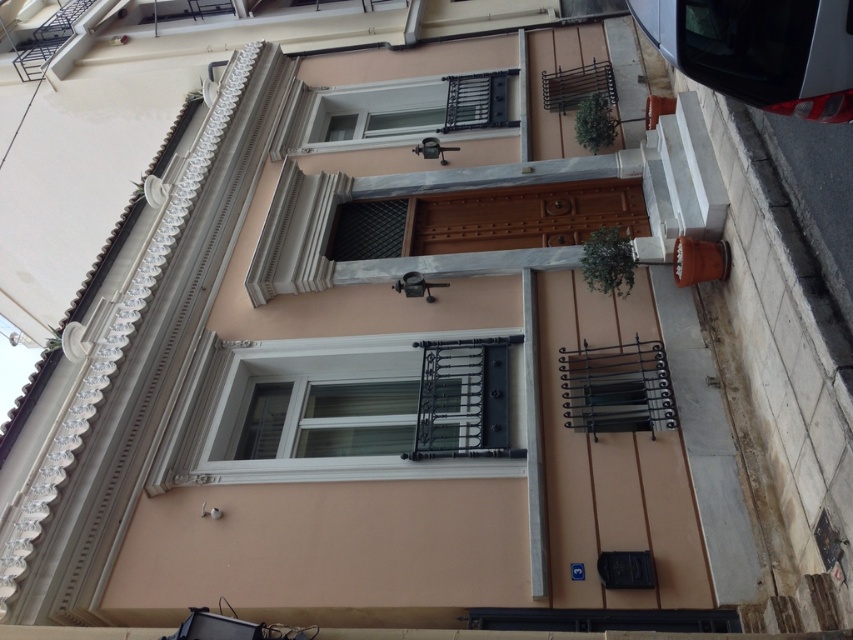
You are standing in front of the residential building and want to know which window you can reach first if you approach the building. Which one is closer to you, the white matte window at center or the white plastic window at upper center?

The white matte window at center is closer to the viewer than the white plastic window at upper center, so you can reach the white matte window at center first.

You are a painter who needs to apply a new coat of paint to both the white matte window at center and the white plastic window at upper center. Which window requires more paint based on their widths?

The white matte window at center requires more paint because its width surpasses that of the white plastic window at upper center.